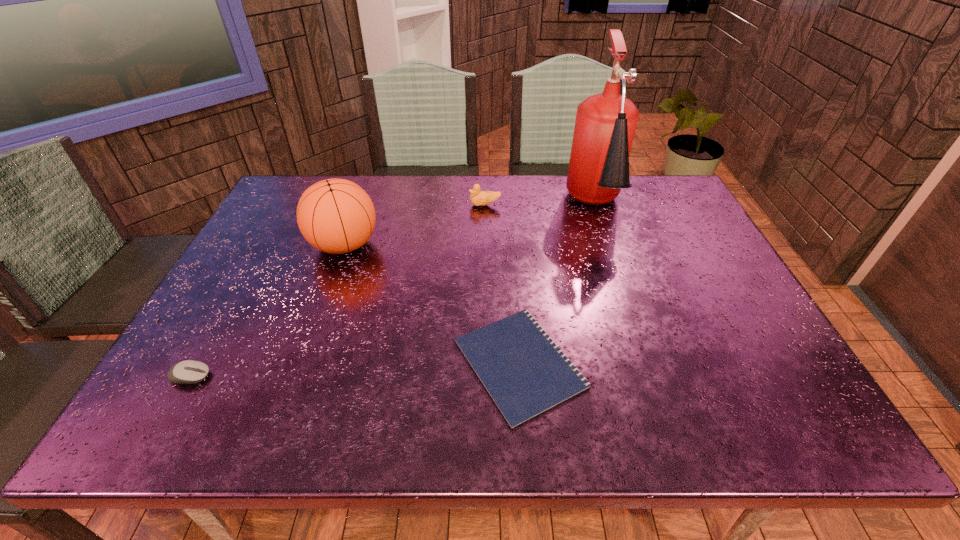
At what (x,y) coordinates should I click in order to perform the action: click on vacant space located 0.100m on the face of the third tallest object. Please return your answer as a coordinate pair (x, y). The image size is (960, 540). Looking at the image, I should click on (438, 205).

Locate an element on the screen. The image size is (960, 540). vacant space located 0.350m on the face of the third tallest object is located at coordinates (358, 205).

The width and height of the screenshot is (960, 540). I want to click on vacant space situated on the face of the third tallest object, so click(355, 205).

The height and width of the screenshot is (540, 960). Find the location of `free space located on the wheel side of the fourth tallest object`. free space located on the wheel side of the fourth tallest object is located at coordinates (348, 376).

Locate an element on the screen. This screenshot has height=540, width=960. free spot located on the left of the notepad is located at coordinates (371, 363).

This screenshot has width=960, height=540. In order to click on fire extinguisher present at the far edge in this screenshot , I will do click(605, 125).

The image size is (960, 540). I want to click on duckling present at the far edge, so click(x=479, y=198).

Where is `object that is at the near edge`? The height and width of the screenshot is (540, 960). object that is at the near edge is located at coordinates (525, 373).

The height and width of the screenshot is (540, 960). What are the coordinates of `object present at the left edge` in the screenshot? It's located at pos(189,371).

The image size is (960, 540). I want to click on vacant space at the far edge of the desktop, so click(522, 209).